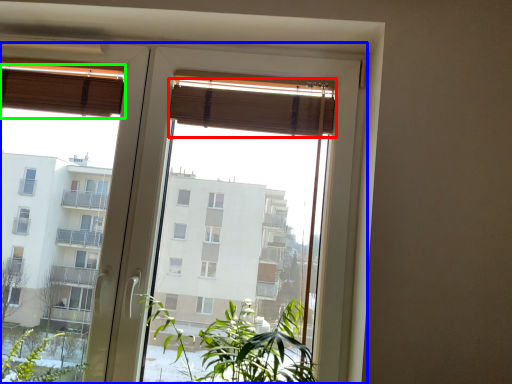
Question: Based on their relative distances, which object is farther from curtain (highlighted by a red box)? Choose from window (highlighted by a blue box) and curtain (highlighted by a green box).

Choices:
 (A) window
 (B) curtain

Answer: (B)